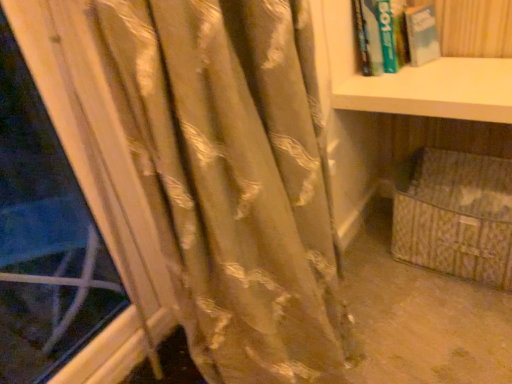
Question: From the image's perspective, is satin gold curtain at left located above or below beige fabric basket at lower right?

Choices:
 (A) above
 (B) below

Answer: (B)

Question: Considering their positions, is satin gold curtain at left located in front of or behind beige fabric basket at lower right?

Choices:
 (A) front
 (B) behind

Answer: (A)

Question: Which of these objects is positioned closest to the beige fabric basket at lower right?

Choices:
 (A) satin gold curtain at left
 (B) beige woven basket at lower right
 (C) green matte book at upper right

Answer: (C)

Question: Which object is positioned closest to the green matte book at upper right?

Choices:
 (A) beige woven basket at lower right
 (B) beige fabric basket at lower right
 (C) satin gold curtain at left

Answer: (B)